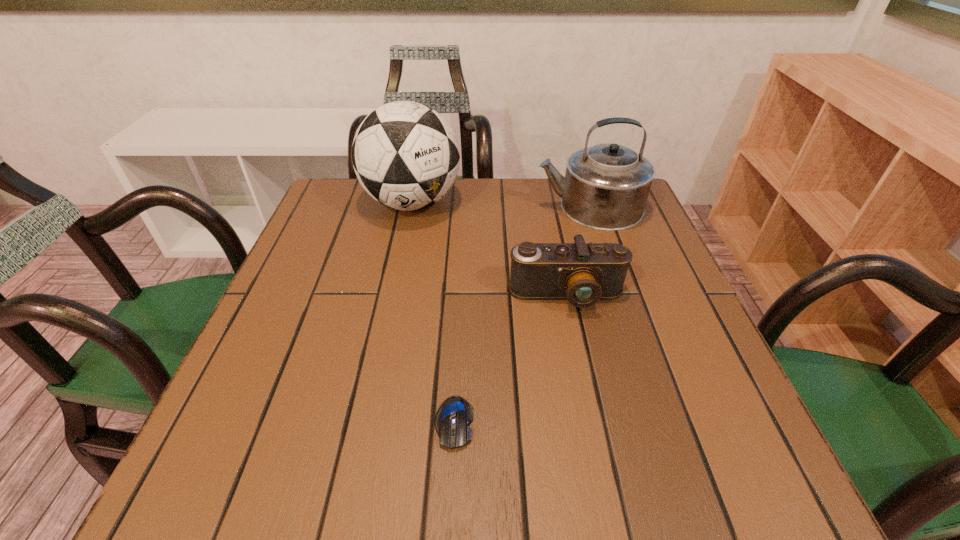
Identify which object is the third nearest to the computer mouse. Please provide its 2D coordinates. Your answer should be formatted as a tuple, i.e. [(x, y)], where the tuple contains the x and y coordinates of a point satisfying the conditions above.

[(606, 187)]

Select which object appears as the second closest to the shortest object. Please provide its 2D coordinates. Your answer should be formatted as a tuple, i.e. [(x, y)], where the tuple contains the x and y coordinates of a point satisfying the conditions above.

[(406, 156)]

Find the location of a particular element. The height and width of the screenshot is (540, 960). blank space that satisfies the following two spatial constraints: 1. with the spout at the front of the kettle; 2. on the lens of the camera is located at coordinates point(618,295).

The width and height of the screenshot is (960, 540). What are the coordinates of `vacant space that satisfies the following two spatial constraints: 1. with the spout at the front of the kettle; 2. on the lens of the second shortest object` in the screenshot? It's located at (618, 295).